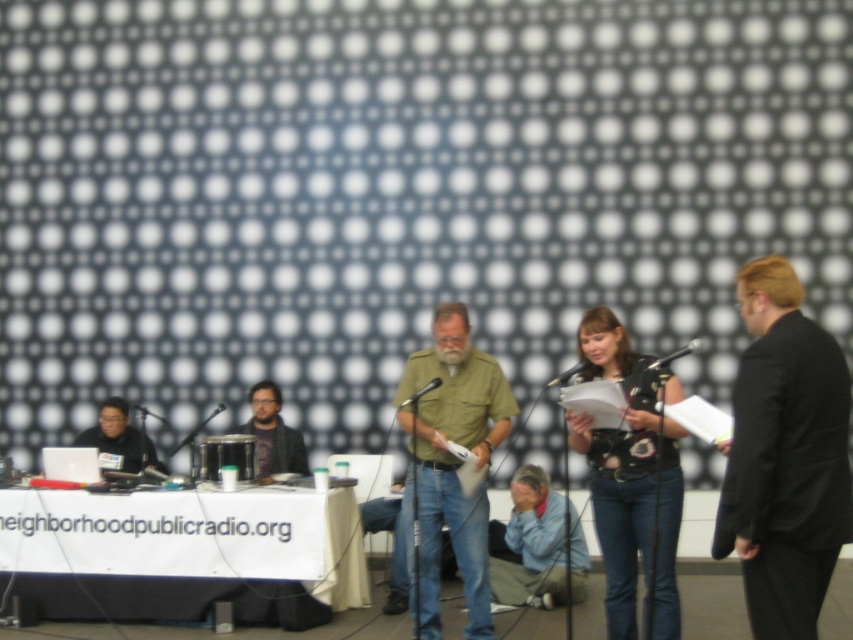
From the picture: Can you confirm if matte black jacket at center is positioned below black plastic microphone at center?

Yes.

Does matte black jacket at center have a greater height compared to black plastic microphone at center?

Correct, matte black jacket at center is much taller as black plastic microphone at center.

At what (x,y) coordinates should I click in order to perform the action: click on matte black jacket at center. Please return your answer as a coordinate pair (x, y). Looking at the image, I should click on (271, 435).

The width and height of the screenshot is (853, 640). Find the location of `matte black jacket at center`. matte black jacket at center is located at coordinates (271, 435).

Can you confirm if green matte shirt at center is positioned above light blue denim jeans at lower center?

Indeed, green matte shirt at center is positioned over light blue denim jeans at lower center.

Is green matte shirt at center bigger than light blue denim jeans at lower center?

Correct, green matte shirt at center is larger in size than light blue denim jeans at lower center.

Locate an element on the screen. Image resolution: width=853 pixels, height=640 pixels. green matte shirt at center is located at coordinates tap(450, 467).

Between black floral shirt at center and green matte shirt at center, which one has more height?

With more height is green matte shirt at center.

Does black floral shirt at center have a lesser height compared to green matte shirt at center?

Correct, black floral shirt at center is not as tall as green matte shirt at center.

Where is `black floral shirt at center`? This screenshot has height=640, width=853. black floral shirt at center is located at coordinates (631, 481).

Locate an element on the screen. Image resolution: width=853 pixels, height=640 pixels. black floral shirt at center is located at coordinates (631, 481).